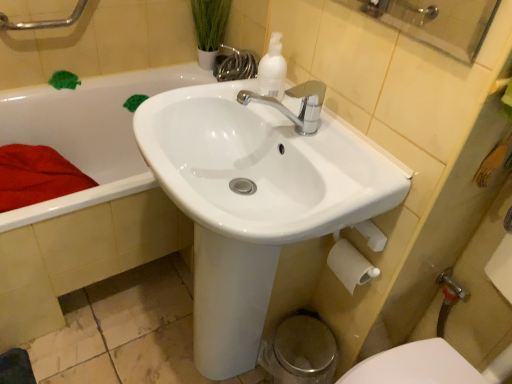
The image size is (512, 384). Find the location of `vacant position to the left of polished chrome faucet at center`. vacant position to the left of polished chrome faucet at center is located at coordinates [211, 102].